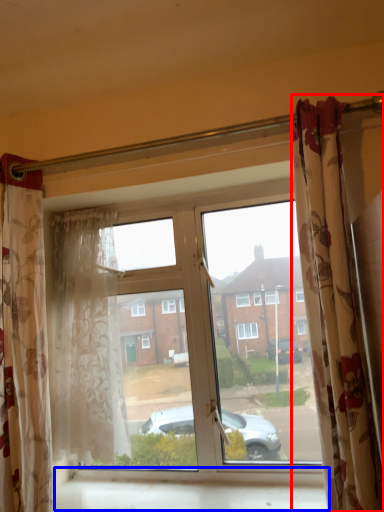
Question: Among these objects, which one is nearest to the camera, curtain (highlighted by a red box) or window sill (highlighted by a blue box)?

Choices:
 (A) curtain
 (B) window sill

Answer: (A)